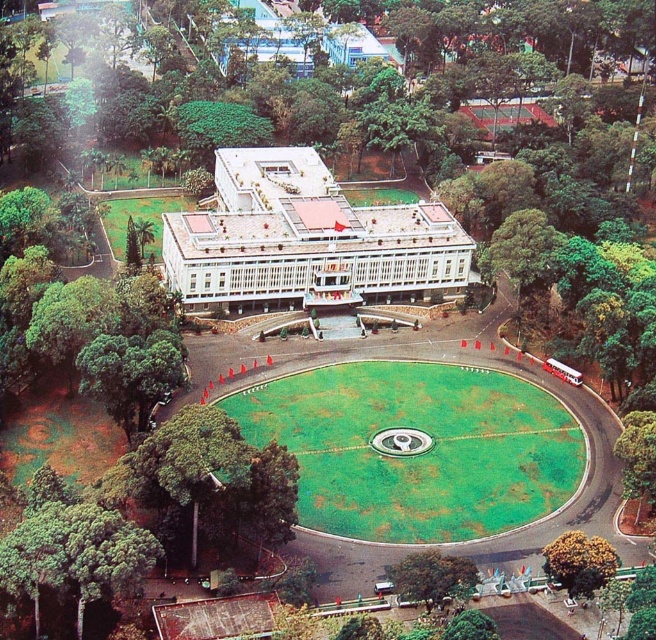
You are standing at the entrance of the building and want to reach the green leafy tree at lower right. Which direction should you walk to avoid the green grass at center?

The green leafy tree at lower right is behind green grass at center, so you should walk around the paved pathway that curves around the lawn to reach it without stepping on the green grass at center.

You are standing at the front entrance of the building and see the green leafy tree at lower left and the green leafy tree at lower center. Which tree is positioned more to your left side?

The green leafy tree at lower left is positioned more to the left side compared to the green leafy tree at lower center.

Based on the photo, you are a landscape architect assessing the symmetry of the building and its surroundings. Considering the green grass at center and the green leafy tree at lower center, which one is taller?

The green grass at center is taller than the green leafy tree at lower center according to the description.